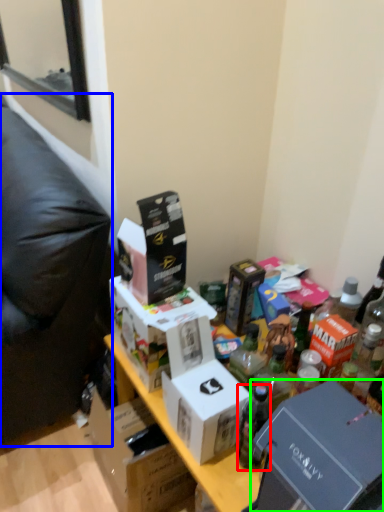
Question: Estimate the real-world distances between objects in this image. Which object is closer to bottle (highlighted by a red box), furniture (highlighted by a blue box) or box (highlighted by a green box)?

Choices:
 (A) furniture
 (B) box

Answer: (B)